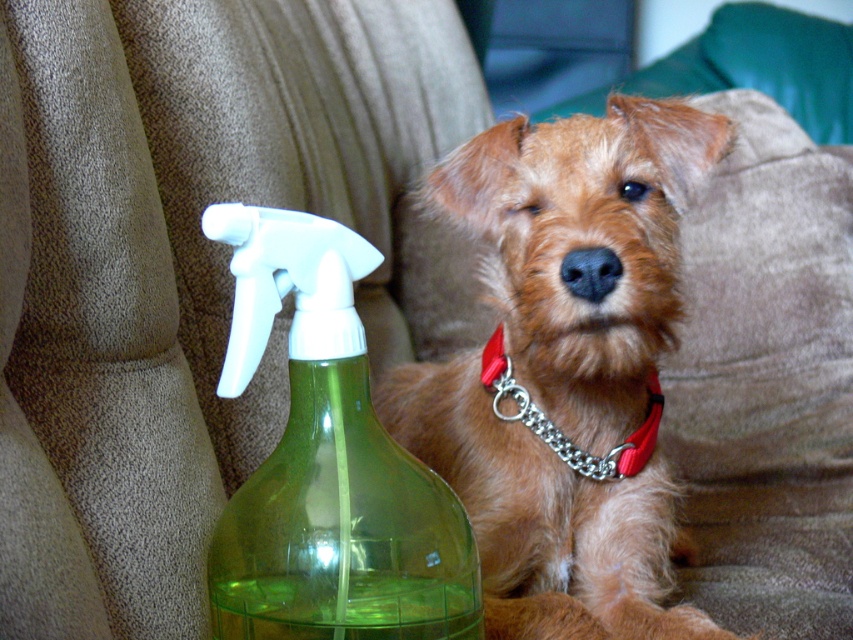
Question: Is green translucent bottle at center above red chain collar at center?

Choices:
 (A) yes
 (B) no

Answer: (B)

Question: Which object is the closest to the green translucent bottle at center?

Choices:
 (A) shiny brown fur at center
 (B) red chain collar at center

Answer: (A)

Question: Where is shiny brown fur at center located in relation to red chain collar at center in the image?

Choices:
 (A) below
 (B) above

Answer: (A)

Question: Which point is closer to the camera?

Choices:
 (A) red chain collar at center
 (B) shiny brown fur at center
 (C) green translucent bottle at center

Answer: (C)

Question: Is green translucent bottle at center in front of red chain collar at center?

Choices:
 (A) yes
 (B) no

Answer: (A)

Question: Considering the real-world distances, which object is closest to the green translucent bottle at center?

Choices:
 (A) shiny brown fur at center
 (B) red chain collar at center

Answer: (A)